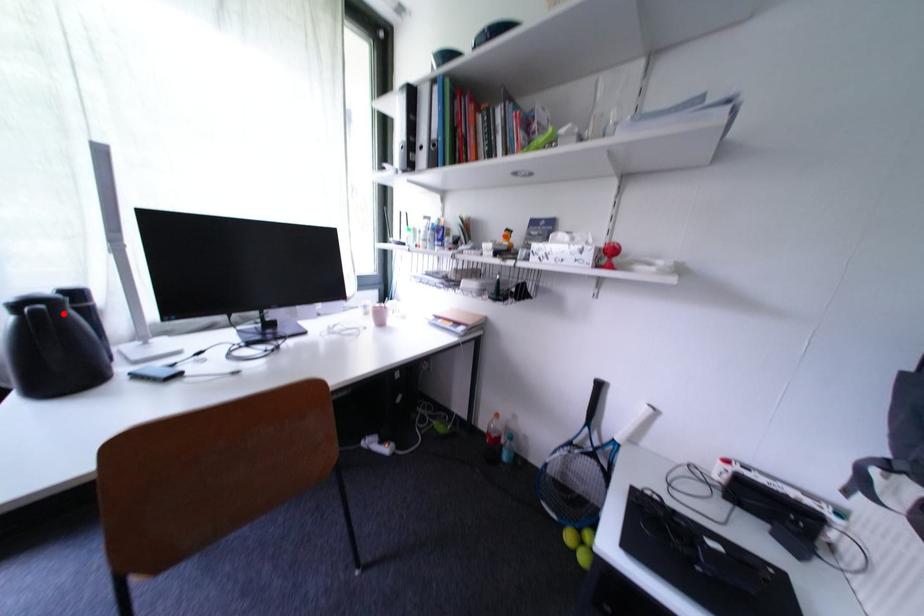
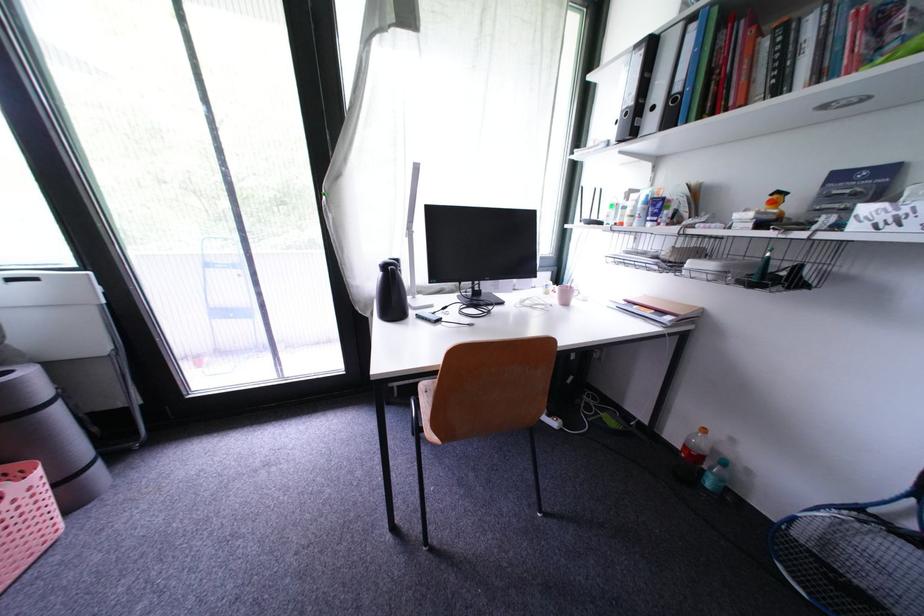
Find the pixel in the second image that matches the highlighted location in the first image.

(398, 274)